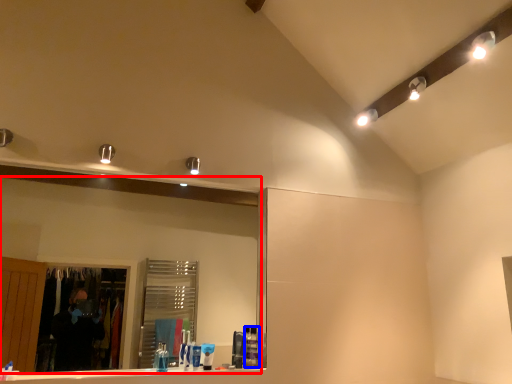
Question: Which object is further to the camera taking this photo, mirror (highlighted by a red box) or toiletry (highlighted by a blue box)?

Choices:
 (A) mirror
 (B) toiletry

Answer: (B)